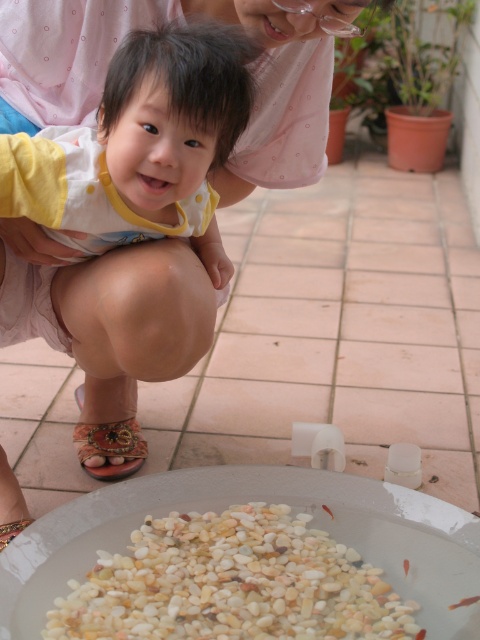
Can you confirm if yellow dotted fabric at center is positioned below white pebbles at bottom?

Actually, yellow dotted fabric at center is above white pebbles at bottom.

Consider the image. Which of these two, yellow dotted fabric at center or white pebbles at bottom, stands shorter?

Standing shorter between the two is white pebbles at bottom.

Where is `yellow dotted fabric at center`? The width and height of the screenshot is (480, 640). yellow dotted fabric at center is located at coordinates (127, 220).

Between yellow dotted fabric at center and leather floral sandal at lower left, which one appears on the left side from the viewer's perspective?

leather floral sandal at lower left is more to the left.

The width and height of the screenshot is (480, 640). Describe the element at coordinates (127, 220) in the screenshot. I see `yellow dotted fabric at center` at that location.

Between point (190, 68) and point (139, 440), which one is positioned in front?

Positioned in front is point (190, 68).

Identify the location of yellow dotted fabric at center. (127, 220).

Can you confirm if white pebbles at bottom is positioned to the right of leather floral sandal at lower left?

Yes, white pebbles at bottom is to the right of leather floral sandal at lower left.

Does white pebbles at bottom appear under leather floral sandal at lower left?

Indeed, white pebbles at bottom is positioned under leather floral sandal at lower left.

Where is `white pebbles at bottom`? The image size is (480, 640). white pebbles at bottom is located at coordinates (231, 582).